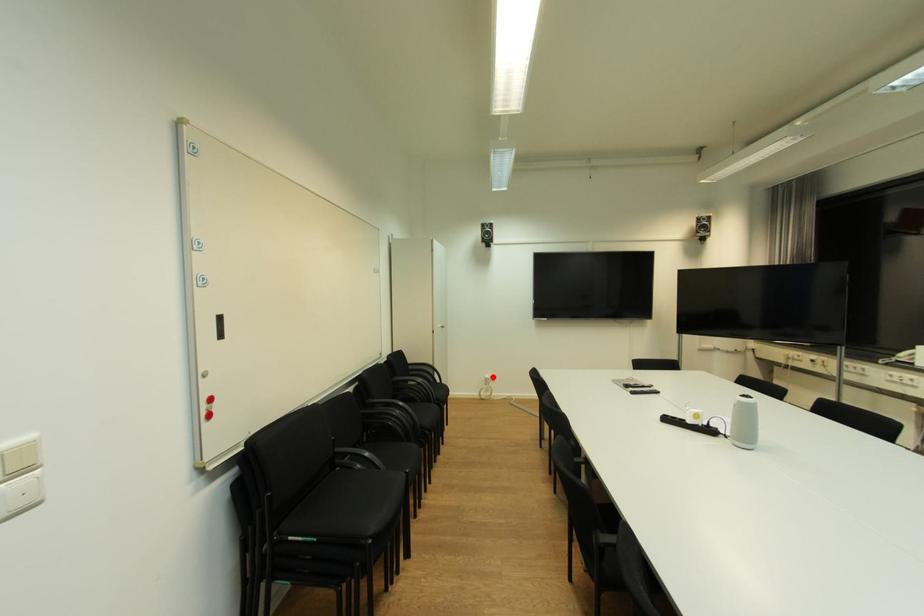
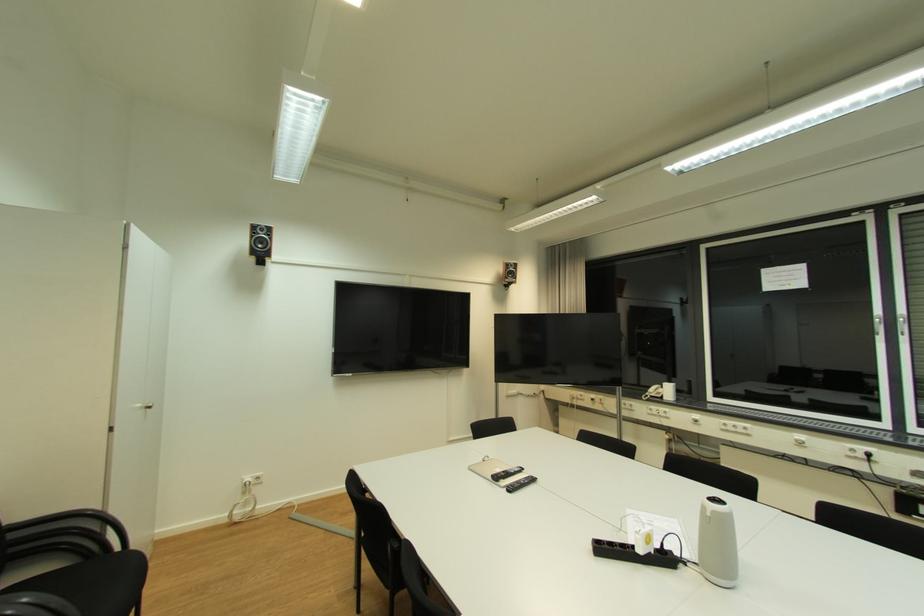
Locate, in the second image, the point that corresponds to the highlighted location in the first image.

(253, 480)